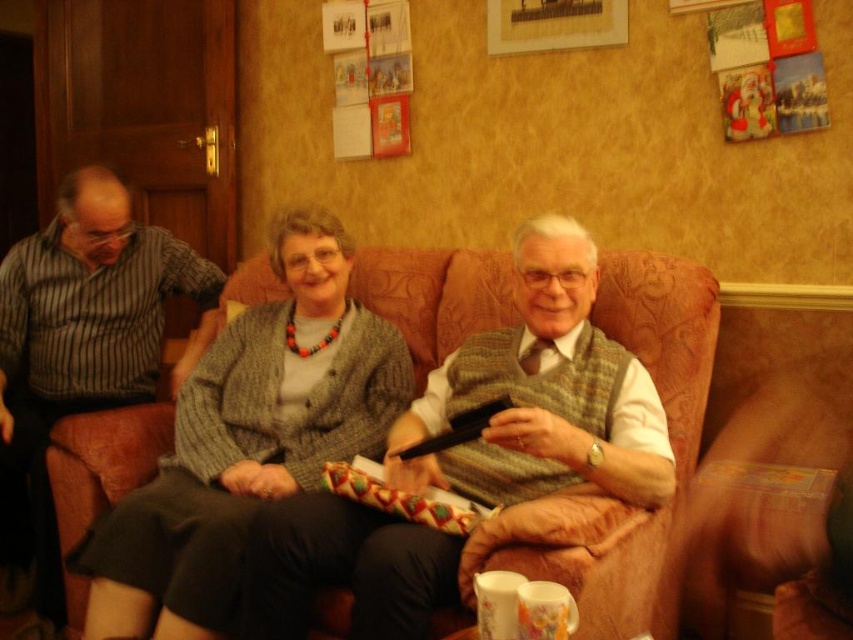
Question: Which of these objects is positioned farthest from the knitted gray sweater at center?

Choices:
 (A) brown fabric couch at center
 (B) striped fabric shirt at left

Answer: (A)

Question: Based on their relative distances, which object is farther from the striped fabric shirt at left?

Choices:
 (A) brown fabric couch at center
 (B) knitted gray sweater at center

Answer: (A)

Question: Which of the following is the closest to the observer?

Choices:
 (A) brown fabric couch at center
 (B) striped fabric shirt at left

Answer: (A)

Question: Does knitted gray sweater at center lie in front of brown fabric couch at center?

Choices:
 (A) yes
 (B) no

Answer: (B)

Question: Does knitted gray sweater at center have a greater width compared to brown fabric couch at center?

Choices:
 (A) yes
 (B) no

Answer: (A)

Question: Can you confirm if brown fabric couch at center is positioned below striped fabric shirt at left?

Choices:
 (A) yes
 (B) no

Answer: (A)